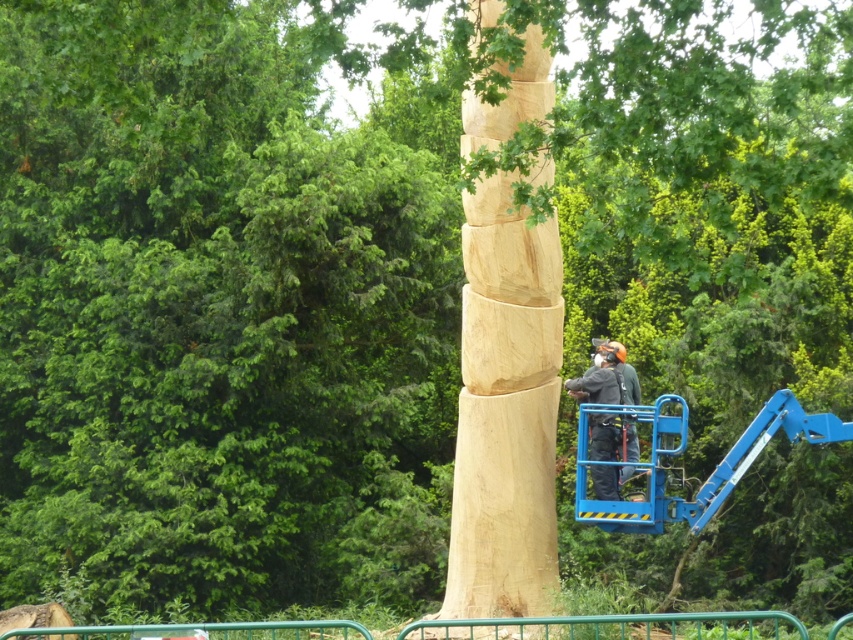
You are standing in front of the large wooden sculpture and want to touch both points mentioned. Which point should you reach for first, the point at coordinate (474, 442) or the point at (599, 444)?

You should reach for the point at coordinate (474, 442) first because it is closer to you than the point at (599, 444).